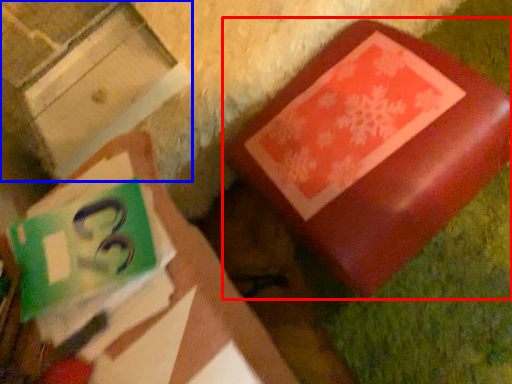
Question: Which point is further to the camera, furniture (highlighted by a red box) or cardboard box (highlighted by a blue box)?

Choices:
 (A) furniture
 (B) cardboard box

Answer: (A)